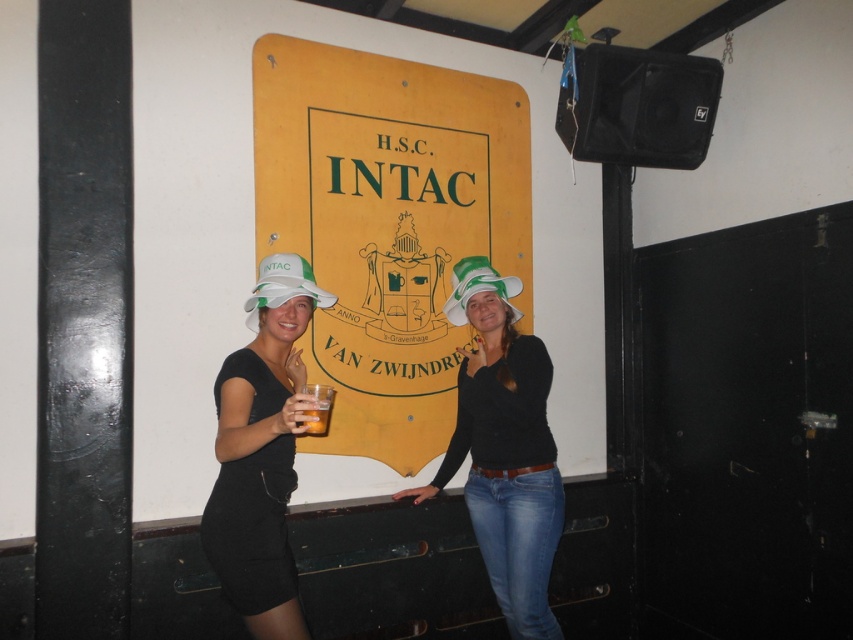
Question: Can you confirm if white fabric hat at upper center is thinner than white fabric hat at left?

Choices:
 (A) no
 (B) yes

Answer: (A)

Question: Is the position of white fabric hat at left more distant than that of translucent glass at center?

Choices:
 (A) yes
 (B) no

Answer: (A)

Question: Does matte white hat at center appear on the right side of green fabric hat at center?

Choices:
 (A) no
 (B) yes

Answer: (A)

Question: Estimate the real-world distances between objects in this image. Which object is farther from the yellow matte signboard at center?

Choices:
 (A) translucent glass at center
 (B) matte white hat at center

Answer: (A)

Question: Which object appears farthest from the camera in this image?

Choices:
 (A) white fabric hat at left
 (B) green fabric hat at center
 (C) translucent glass at center

Answer: (B)

Question: Which point is closer to the camera?

Choices:
 (A) white fabric hat at left
 (B) green fabric hat at center
 (C) white fabric hat at upper center

Answer: (C)